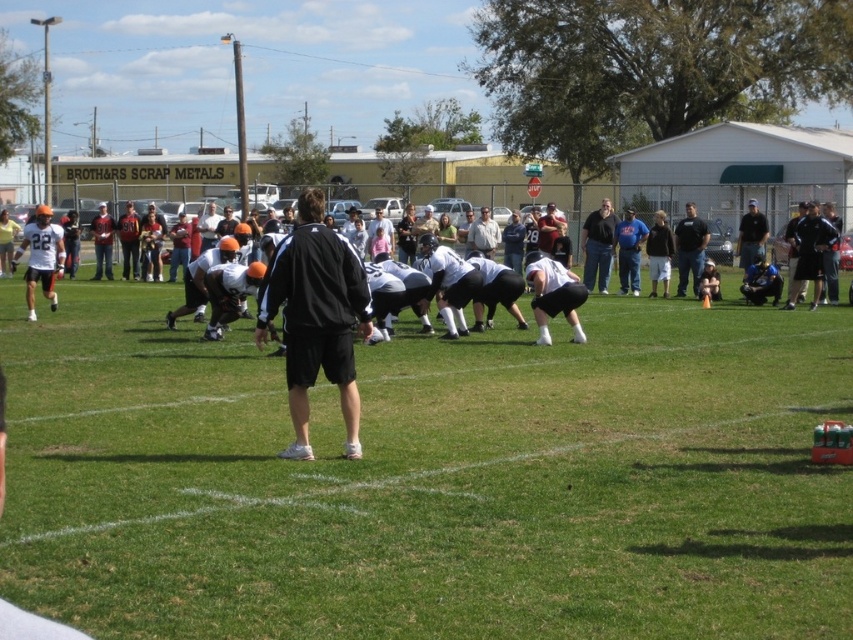
Question: In this image, where is green grass field at center located relative to white matte football team at center?

Choices:
 (A) below
 (B) above

Answer: (A)

Question: Among these points, which one is nearest to the camera?

Choices:
 (A) (283, 275)
 (B) (480, 241)
 (C) (605, 248)
 (D) (775, 460)

Answer: (A)

Question: Which is nearer to the black matte jacket at center?

Choices:
 (A) white matte football team at center
 (B) dark gray shirt at right
 (C) light gray fabric shirt at center

Answer: (A)

Question: Estimate the real-world distances between objects in this image. Which object is farther from the black matte shirt at center?

Choices:
 (A) dark gray shirt at right
 (B) white matte football team at center
 (C) light gray fabric shirt at center
 (D) dark blue shirt at center

Answer: (B)

Question: Can you confirm if black matte jacket at center is positioned to the right of dark blue shirt at center?

Choices:
 (A) no
 (B) yes

Answer: (A)

Question: Does green grass field at center have a lesser width compared to black matte jacket at center?

Choices:
 (A) yes
 (B) no

Answer: (B)